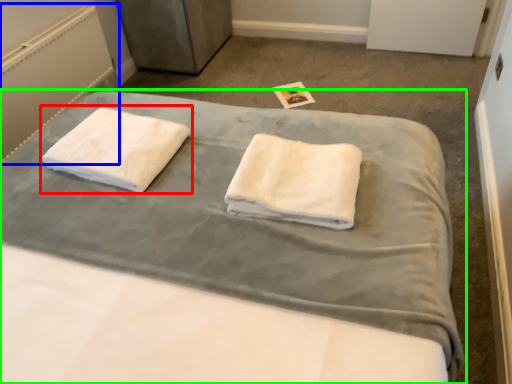
Question: Which is farther away from towel (highlighted by a red box)? radiator (highlighted by a blue box) or bed (highlighted by a green box)?

Choices:
 (A) radiator
 (B) bed

Answer: (A)